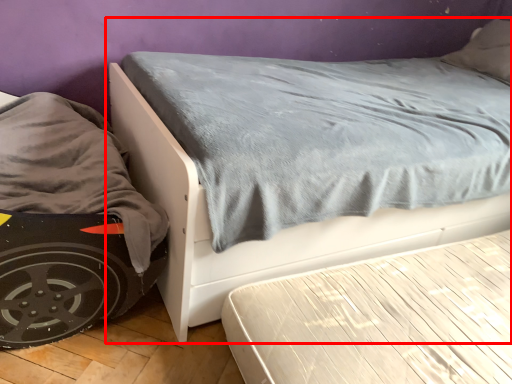
Question: In this image, where is bed (annotated by the red box) located relative to bed frame?

Choices:
 (A) right
 (B) left

Answer: (B)